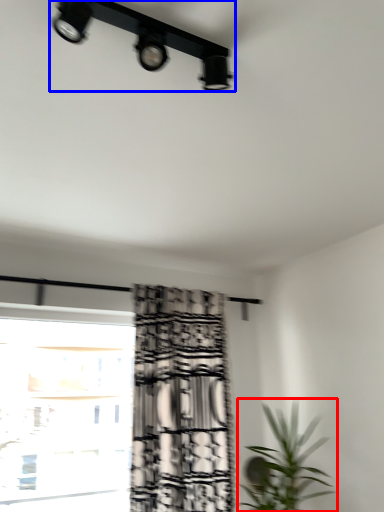
Question: Which of the following is the closest to the observer, houseplant (highlighted by a red box) or lamp (highlighted by a blue box)?

Choices:
 (A) houseplant
 (B) lamp

Answer: (B)